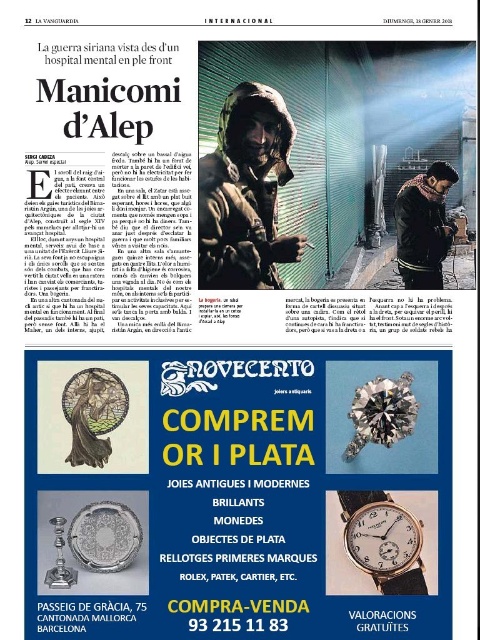
You are a fashion designer analyzing the image. You need to determine which item is narrower between the matte black jacket at center and the dark wool scarf at upper right. Which one would you choose?

The matte black jacket at center has a lesser width compared to the dark wool scarf at upper right, so the matte black jacket at center is narrower.

Based on the coordinates provided, which object is located at point (x=245, y=193) in the image?

The point (x=245, y=193) corresponds to the matte black jacket at center.